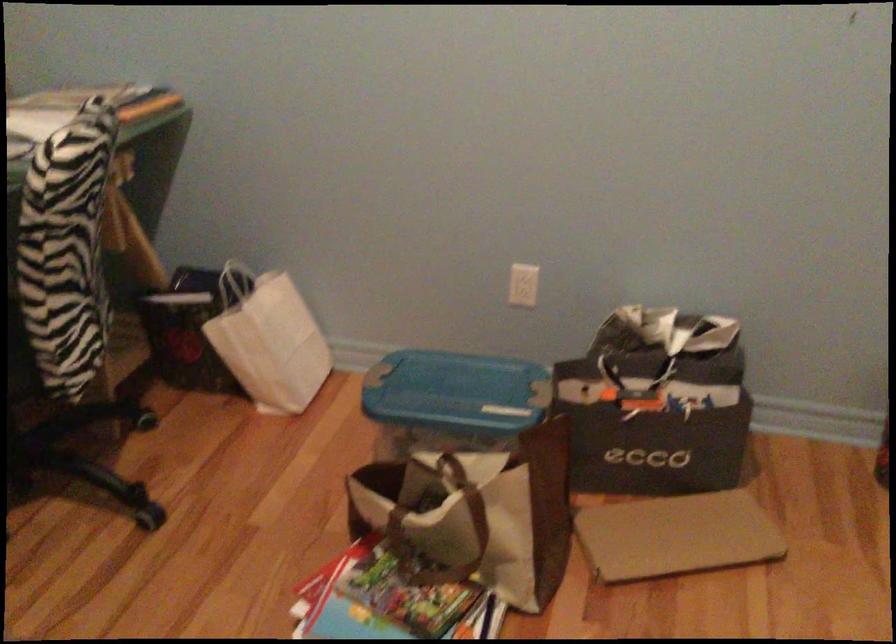
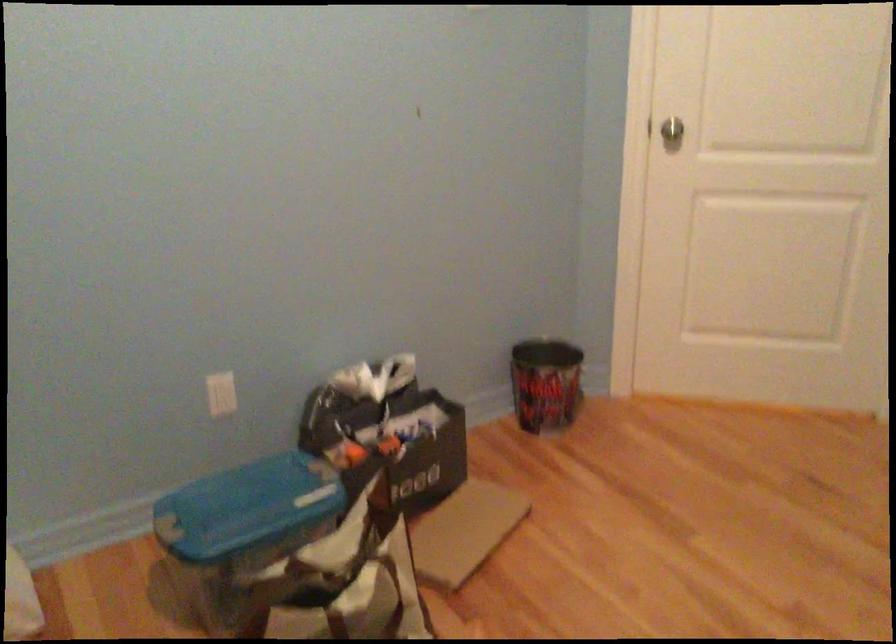
The point at (452, 389) is marked in the first image. Where is the corresponding point in the second image?

(247, 507)